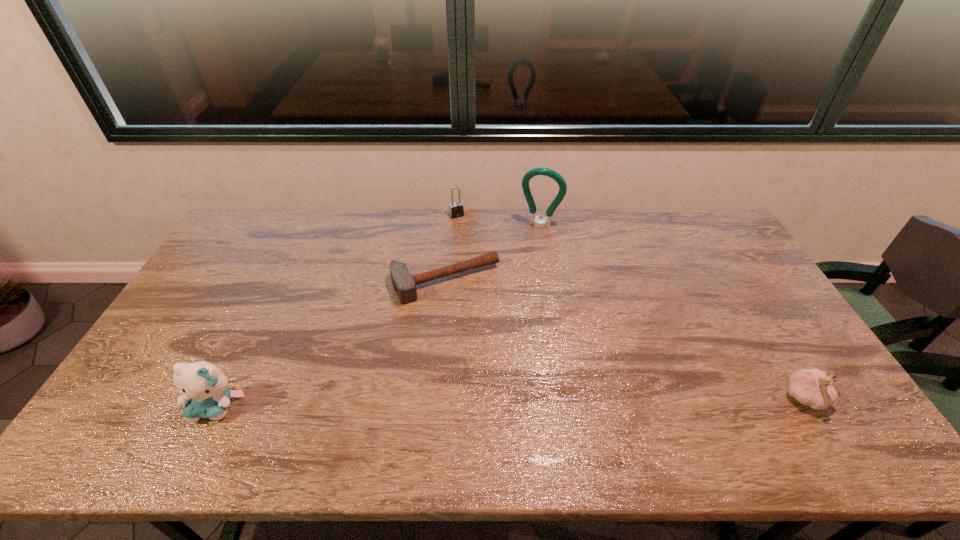
Where is `empty location between the rightmost object and the tallest object`? empty location between the rightmost object and the tallest object is located at coordinates (672, 311).

You are a GUI agent. You are given a task and a screenshot of the screen. Output one action in this format:
    pyautogui.click(x=<x>, y=<y>)
    Task: Click on the free space that is in between the fourth shortest object and the garlic
    The height and width of the screenshot is (540, 960).
    Given the screenshot: What is the action you would take?
    pyautogui.click(x=510, y=402)

Where is `free space between the leftmost object and the padlock`? The width and height of the screenshot is (960, 540). free space between the leftmost object and the padlock is located at coordinates (336, 311).

The height and width of the screenshot is (540, 960). Identify the location of empty location between the leftmost object and the shortest object. (331, 344).

Locate an element on the screen. free space between the kitten and the garlic is located at coordinates (510, 402).

I want to click on empty location between the padlock and the tallest object, so click(x=498, y=220).

Locate an element on the screen. The width and height of the screenshot is (960, 540). vacant space in between the garlic and the second tallest object is located at coordinates (510, 402).

Where is `empty space that is in between the tallest object and the padlock`? The image size is (960, 540). empty space that is in between the tallest object and the padlock is located at coordinates (498, 220).

Find the location of `free area in between the leftmost object and the shortest object`. free area in between the leftmost object and the shortest object is located at coordinates (331, 344).

The image size is (960, 540). What are the coordinates of `object that is the second nearest to the leftmost object` in the screenshot? It's located at (456, 209).